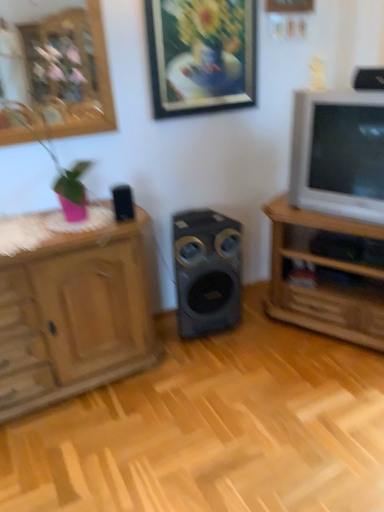
I want to click on matte black speaker at center, the 1th speaker ordered from the bottom, so click(x=207, y=271).

Describe the element at coordinates (207, 271) in the screenshot. I see `matte black speaker at center, which is the second speaker from left to right` at that location.

Locate an element on the screen. The width and height of the screenshot is (384, 512). black plastic speaker at upper left, acting as the second speaker starting from the top is located at coordinates (123, 203).

The image size is (384, 512). Describe the element at coordinates (123, 203) in the screenshot. I see `black plastic speaker at upper left, which is counted as the third speaker, starting from the right` at that location.

What do you see at coordinates (201, 55) in the screenshot? I see `metallic gold picture frame at upper center` at bounding box center [201, 55].

This screenshot has height=512, width=384. Find the location of `metallic gold picture frame at upper center`. metallic gold picture frame at upper center is located at coordinates point(201,55).

Find the location of a particular element. This screenshot has height=512, width=384. matte black speaker at center, which appears as the 3th speaker when viewed from the front is located at coordinates (207, 271).

Which of these two, black plastic speaker at upper right, which appears as the first speaker when viewed from the right, or metallic gold picture frame at upper center, stands shorter?

black plastic speaker at upper right, which appears as the first speaker when viewed from the right, is shorter.

Is black plastic speaker at upper right, which appears as the first speaker when viewed from the right, inside the boundaries of metallic gold picture frame at upper center, or outside?

black plastic speaker at upper right, which appears as the first speaker when viewed from the right, exists outside the volume of metallic gold picture frame at upper center.

Which is nearer, (355, 83) or (165, 83)?

The point (165, 83) is closer to the camera.

Consider the image. From a real-world perspective, which object rests below the other?

In real-world perspective, black plastic speaker at upper right, the third speaker positioned from the bottom, is lower.

Looking at this image, from a real-world perspective, is black plastic speaker at upper left, which is the 1th speaker in left-to-right order, on wooden cabinet at left?

Indeed, from a real-world perspective, black plastic speaker at upper left, which is the 1th speaker in left-to-right order, stands above wooden cabinet at left.

Is black plastic speaker at upper left, the second speaker viewed from the back, turned away from wooden cabinet at left?

No, black plastic speaker at upper left, the second speaker viewed from the back, is not facing the opposite direction of wooden cabinet at left.

Is black plastic speaker at upper left, which is counted as the third speaker, starting from the right, to the left or to the right of wooden cabinet at left in the image?

Clearly, black plastic speaker at upper left, which is counted as the third speaker, starting from the right, is on the right of wooden cabinet at left in the image.

Is black plastic speaker at upper left, acting as the second speaker starting from the top, inside the boundaries of wooden cabinet at left, or outside?

black plastic speaker at upper left, acting as the second speaker starting from the top, is located beyond the bounds of wooden cabinet at left.

Is wooden tv stand at right positioned with its back to matte gray television at right?

No.

Is point (272, 296) closer to camera compared to point (318, 170)?

No, it is behind (318, 170).

Considering the positions of objects wooden tv stand at right and matte gray television at right in the image provided, who is in front, wooden tv stand at right or matte gray television at right?

matte gray television at right is closer to the camera.

How many degrees apart are the facing directions of matte black speaker at center, which ranks as the 1th speaker in back-to-front order, and black plastic speaker at upper left, acting as the 2th speaker starting from the front?

There is a 3.76-degree angle between the facing directions of matte black speaker at center, which ranks as the 1th speaker in back-to-front order, and black plastic speaker at upper left, acting as the 2th speaker starting from the front.

How far apart are matte black speaker at center, which ranks as the 1th speaker in back-to-front order, and black plastic speaker at upper left, which is the 1th speaker in left-to-right order?

22.33 inches.

Considering the sizes of objects matte black speaker at center, which ranks as the 1th speaker in back-to-front order, and black plastic speaker at upper left, the second speaker viewed from the back, in the image provided, who is thinner, matte black speaker at center, which ranks as the 1th speaker in back-to-front order, or black plastic speaker at upper left, the second speaker viewed from the back,?

black plastic speaker at upper left, the second speaker viewed from the back, is thinner.

Could you tell me if matte black speaker at center, acting as the second speaker starting from the right, is facing black plastic speaker at upper left, arranged as the 2th speaker when ordered from the bottom?

No.

Considering the relative sizes of black plastic speaker at upper left, the second speaker viewed from the back, and black plastic speaker at upper right, marked as the third speaker in a back-to-front arrangement, in the image provided, is black plastic speaker at upper left, the second speaker viewed from the back, bigger than black plastic speaker at upper right, marked as the third speaker in a back-to-front arrangement,?

No, black plastic speaker at upper left, the second speaker viewed from the back, is not bigger than black plastic speaker at upper right, marked as the third speaker in a back-to-front arrangement.

Is black plastic speaker at upper left, acting as the second speaker starting from the top, facing away from black plastic speaker at upper right, marked as the first speaker in a top-to-bottom arrangement?

That's not correct — black plastic speaker at upper left, acting as the second speaker starting from the top, is not looking away from black plastic speaker at upper right, marked as the first speaker in a top-to-bottom arrangement.

Which is more to the left, black plastic speaker at upper left, which is counted as the third speaker, starting from the right, or black plastic speaker at upper right, which appears as the first speaker when viewed from the right?

black plastic speaker at upper left, which is counted as the third speaker, starting from the right, is more to the left.

From a real-world perspective, is black plastic speaker at upper left, the second speaker viewed from the back, above or below black plastic speaker at upper right, which appears as the first speaker when viewed from the right?

black plastic speaker at upper left, the second speaker viewed from the back, is below black plastic speaker at upper right, which appears as the first speaker when viewed from the right.

Considering the sizes of objects matte gray television at right and black plastic speaker at upper left, which is the 1th speaker in left-to-right order, in the image provided, who is smaller, matte gray television at right or black plastic speaker at upper left, which is the 1th speaker in left-to-right order,?

black plastic speaker at upper left, which is the 1th speaker in left-to-right order.

Which is in front, matte gray television at right or black plastic speaker at upper left, acting as the second speaker starting from the top?

Positioned in front is matte gray television at right.

Locate an element on the screen. The height and width of the screenshot is (512, 384). the 1st speaker behind the matte gray television at right is located at coordinates (123, 203).

From the picture: How many degrees apart are the facing directions of matte gray television at right and black plastic speaker at upper left, which is the 1th speaker in left-to-right order?

The facing directions of matte gray television at right and black plastic speaker at upper left, which is the 1th speaker in left-to-right order, are 63.7 degrees apart.

From a real-world perspective, is wooden cabinet at left positioned over black plastic speaker at upper right, which appears as the first speaker when viewed from the right, based on gravity?

Incorrect, from a real-world perspective, wooden cabinet at left is lower than black plastic speaker at upper right, which appears as the first speaker when viewed from the right.

From the image's perspective, between wooden cabinet at left and black plastic speaker at upper right, marked as the first speaker in a top-to-bottom arrangement, which one is located above?

black plastic speaker at upper right, marked as the first speaker in a top-to-bottom arrangement, is shown above in the image.

Considering the sizes of objects wooden cabinet at left and black plastic speaker at upper right, marked as the third speaker in a back-to-front arrangement, in the image provided, who is wider, wooden cabinet at left or black plastic speaker at upper right, marked as the third speaker in a back-to-front arrangement,?

Wider between the two is wooden cabinet at left.

Relative to black plastic speaker at upper right, which appears as the 1th speaker when viewed from the front, is wooden cabinet at left in front or behind?

wooden cabinet at left is in front of black plastic speaker at upper right, which appears as the 1th speaker when viewed from the front.

From a real-world perspective, which speaker is the 1st one underneath the metallic gold picture frame at upper center? Please provide its 2D coordinates.

[(369, 79)]

The width and height of the screenshot is (384, 512). In the image, there is a black plastic speaker at upper left, acting as the second speaker starting from the top. Identify the location of cabinetry below it (from the image's perspective). (74, 315).

When comparing their distances from wooden cabinet at left, does black plastic speaker at upper right, marked as the third speaker in a back-to-front arrangement, or matte gray television at right seem further?

black plastic speaker at upper right, marked as the third speaker in a back-to-front arrangement, is further to wooden cabinet at left.

Estimate the real-world distances between objects in this image. Which object is further from matte black speaker at center, the 1th speaker ordered from the bottom, wooden cabinet at left or metallic gold picture frame at upper center?

metallic gold picture frame at upper center lies further to matte black speaker at center, the 1th speaker ordered from the bottom, than the other object.

Looking at the image, which one is located closer to black plastic speaker at upper right, which is the third speaker from left to right, metallic gold picture frame at upper center or wooden cabinet at left?

metallic gold picture frame at upper center is positioned closer to the anchor black plastic speaker at upper right, which is the third speaker from left to right.

Considering their positions, is wooden cabinet at left positioned closer to metallic gold picture frame at upper center than black plastic speaker at upper right, which is the third speaker from left to right?

black plastic speaker at upper right, which is the third speaker from left to right.

When comparing their distances from black plastic speaker at upper left, which is the 1th speaker in left-to-right order, does black plastic speaker at upper right, marked as the first speaker in a top-to-bottom arrangement, or matte black speaker at center, the 3th speaker positioned from the top, seem further?

Based on the image, black plastic speaker at upper right, marked as the first speaker in a top-to-bottom arrangement, appears to be further to black plastic speaker at upper left, which is the 1th speaker in left-to-right order.

Based on their spatial positions, is black plastic speaker at upper right, marked as the third speaker in a back-to-front arrangement, or metallic gold picture frame at upper center closer to wooden cabinet at left?

Based on the image, metallic gold picture frame at upper center appears to be nearer to wooden cabinet at left.

When comparing their distances from metallic gold picture frame at upper center, does black plastic speaker at upper left, which is counted as the third speaker, starting from the right, or wooden cabinet at left seem closer?

Based on the image, black plastic speaker at upper left, which is counted as the third speaker, starting from the right, appears to be nearer to metallic gold picture frame at upper center.

Based on the photo, when comparing their distances from metallic gold picture frame at upper center, does wooden tv stand at right or black plastic speaker at upper left, the second speaker viewed from the back, seem further?

Among the two, wooden tv stand at right is located further to metallic gold picture frame at upper center.

Find the location of `picture frame situated between wooden cabinet at left and black plastic speaker at upper right, the third speaker positioned from the bottom, from left to right`. picture frame situated between wooden cabinet at left and black plastic speaker at upper right, the third speaker positioned from the bottom, from left to right is located at coordinates (201, 55).

Where is `television between black plastic speaker at upper right, the third speaker positioned from the bottom, and wooden tv stand at right, in the vertical direction`? Image resolution: width=384 pixels, height=512 pixels. television between black plastic speaker at upper right, the third speaker positioned from the bottom, and wooden tv stand at right, in the vertical direction is located at coordinates (339, 154).

You are a GUI agent. You are given a task and a screenshot of the screen. Output one action in this format:
    pyautogui.click(x=<x>, y=<y>)
    Task: Click on the picture frame located between black plastic speaker at upper left, the second speaker viewed from the back, and matte gray television at right in the left-right direction
    Image resolution: width=384 pixels, height=512 pixels.
    Given the screenshot: What is the action you would take?
    pyautogui.click(x=201, y=55)

I want to click on picture frame situated between black plastic speaker at upper left, arranged as the 2th speaker when ordered from the bottom, and wooden tv stand at right from left to right, so click(201, 55).